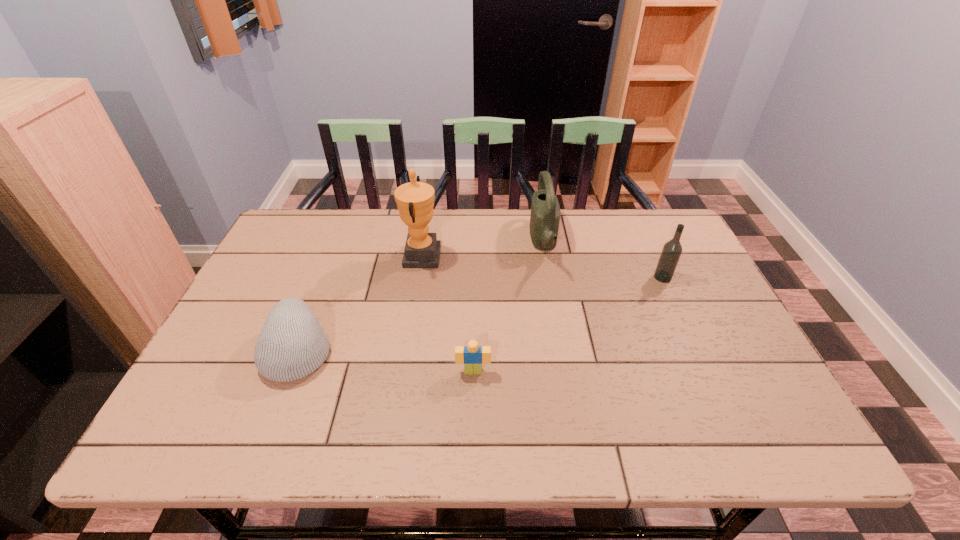
You are a GUI agent. You are given a task and a screenshot of the screen. Output one action in this format:
    pyautogui.click(x=<x>, y=<y>)
    Task: Click on the vacant space situated 0.080m on the spout of the watering can
    
    Given the screenshot: What is the action you would take?
    pyautogui.click(x=504, y=242)

You are a GUI agent. You are given a task and a screenshot of the screen. Output one action in this format:
    pyautogui.click(x=<x>, y=<y>)
    Task: Click on the vacant space situated on the spout of the watering can
    The width and height of the screenshot is (960, 540).
    Given the screenshot: What is the action you would take?
    tap(492, 242)

Locate an element on the screen. vacant space located on the left of the vodka is located at coordinates (564, 277).

I want to click on vacant space located 0.190m on the back of the leftmost object, so click(329, 269).

Where is `vacant space located on the face of the shortest object`? This screenshot has width=960, height=540. vacant space located on the face of the shortest object is located at coordinates (472, 407).

Find the location of a particular element. award that is at the far edge is located at coordinates (415, 200).

Image resolution: width=960 pixels, height=540 pixels. I want to click on watering can at the far edge, so click(545, 214).

Where is `object situated at the left edge`? object situated at the left edge is located at coordinates (292, 344).

I want to click on object present at the right edge, so click(671, 252).

Locate an element on the screen. Image resolution: width=960 pixels, height=540 pixels. vacant space at the far edge of the desktop is located at coordinates (506, 239).